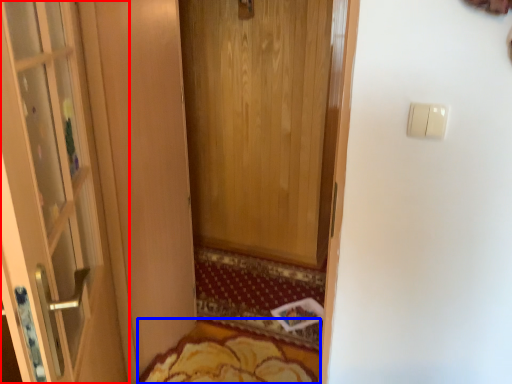
Question: Which of the following is the farthest to the observer, door (highlighted by a red box) or mat (highlighted by a blue box)?

Choices:
 (A) door
 (B) mat

Answer: (B)